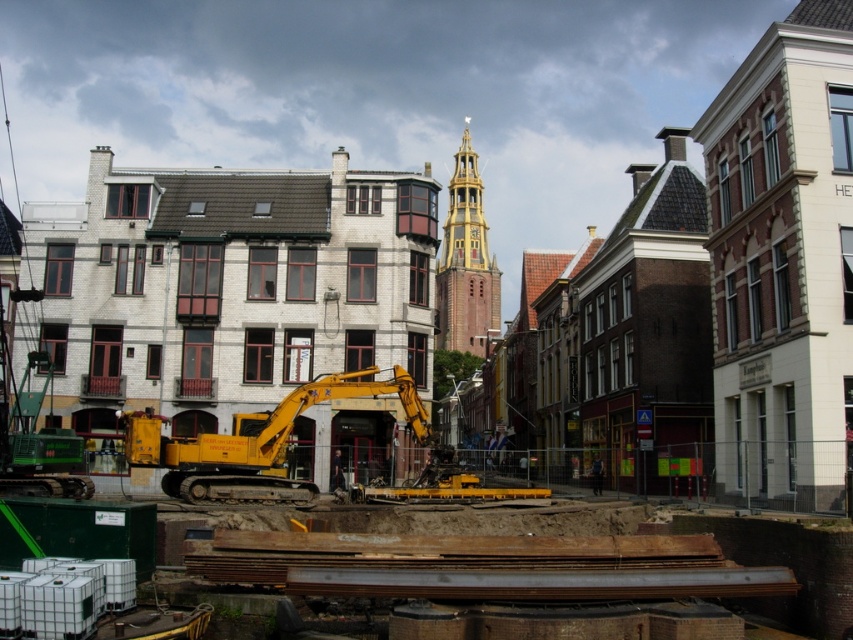
Question: Which point is farther from the camera taking this photo?

Choices:
 (A) (132, 422)
 (B) (469, 198)

Answer: (B)

Question: Considering the relative positions of yellow metallic excavator at center and gold textured clock tower at center in the image provided, where is yellow metallic excavator at center located with respect to gold textured clock tower at center?

Choices:
 (A) above
 (B) below

Answer: (B)

Question: Which of the following is the farthest from the observer?

Choices:
 (A) (288, 477)
 (B) (476, 221)

Answer: (B)

Question: Does yellow metallic excavator at center have a larger size compared to gold textured clock tower at center?

Choices:
 (A) no
 (B) yes

Answer: (A)

Question: Which point is closer to the camera?

Choices:
 (A) (483, 308)
 (B) (412, 378)

Answer: (B)

Question: Can you confirm if yellow metallic excavator at center is positioned above gold textured clock tower at center?

Choices:
 (A) no
 (B) yes

Answer: (A)